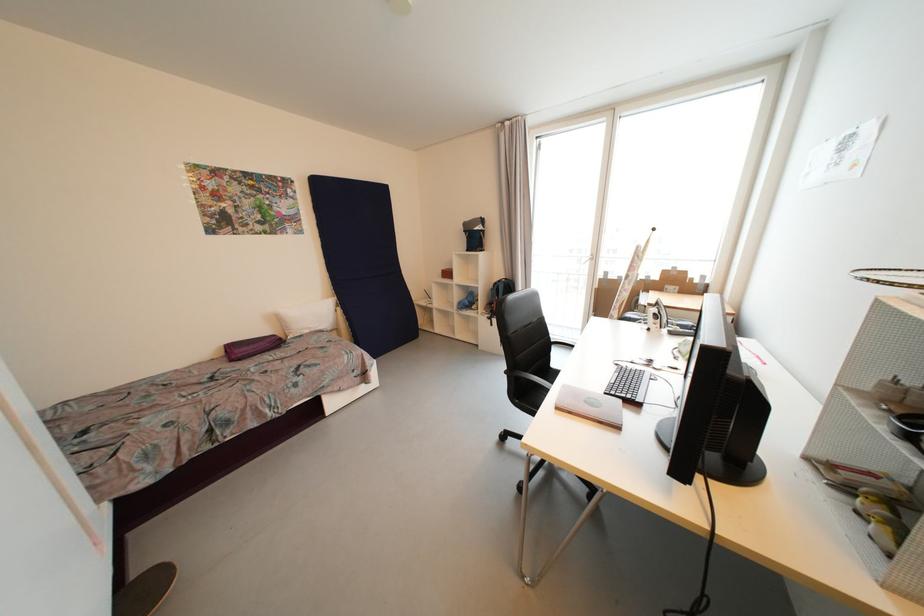
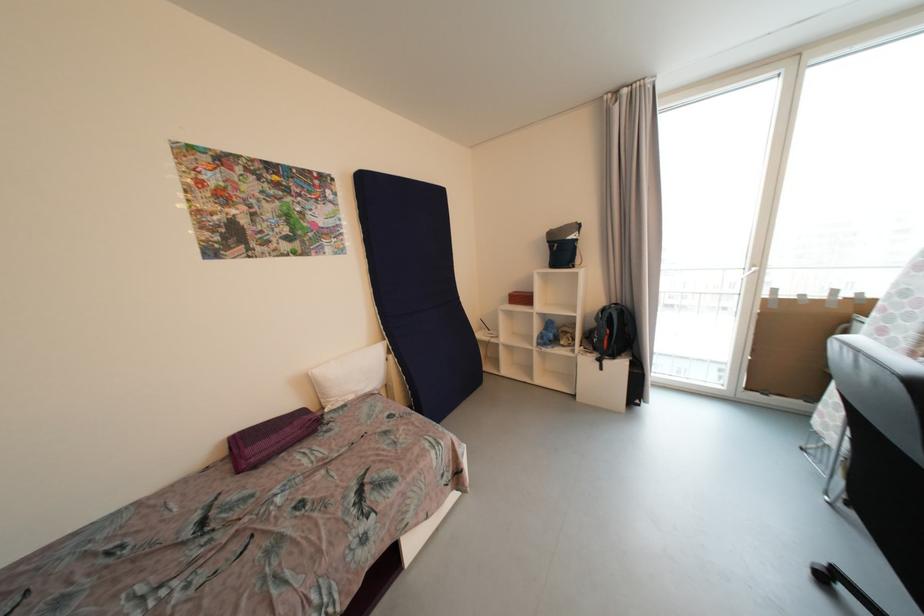
Find the pixel in the second image that matches point (501, 285) in the first image.

(608, 312)